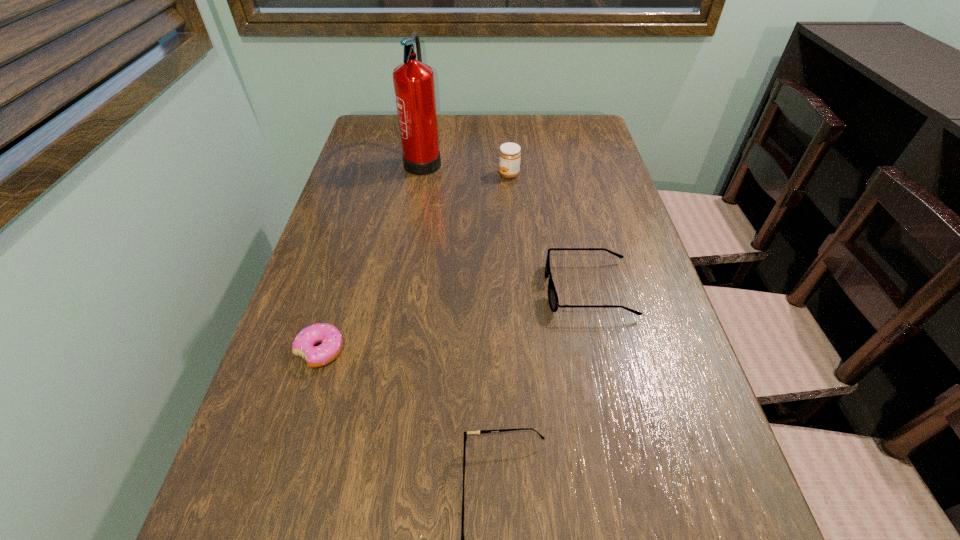
The width and height of the screenshot is (960, 540). I want to click on free space located on the front label of the fourth shortest object, so click(427, 174).

Locate an element on the screen. vacant space positioned 0.190m on the front-facing side of the farther spectacles is located at coordinates (456, 289).

Where is `free spot located 0.060m on the front-facing side of the farther spectacles`? The height and width of the screenshot is (540, 960). free spot located 0.060m on the front-facing side of the farther spectacles is located at coordinates click(517, 289).

The image size is (960, 540). Identify the location of free region located on the front-facing side of the farther spectacles. pyautogui.click(x=480, y=289).

At what (x,y) coordinates should I click in order to perform the action: click on vacant space located on the right of the shortest object. Please return your answer as a coordinate pair (x, y). Looking at the image, I should click on (537, 351).

The width and height of the screenshot is (960, 540). In order to click on object present at the far edge in this screenshot , I will do `click(414, 87)`.

Identify the location of fire extinguisher that is at the left edge. (414, 87).

I want to click on doughnut present at the left edge, so click(x=331, y=339).

At what (x,y) coordinates should I click in order to perform the action: click on object that is at the right edge. Please return your answer as a coordinate pair (x, y). The height and width of the screenshot is (540, 960). Looking at the image, I should click on coord(553,299).

Where is `object located at the far left corner`? object located at the far left corner is located at coordinates (414, 87).